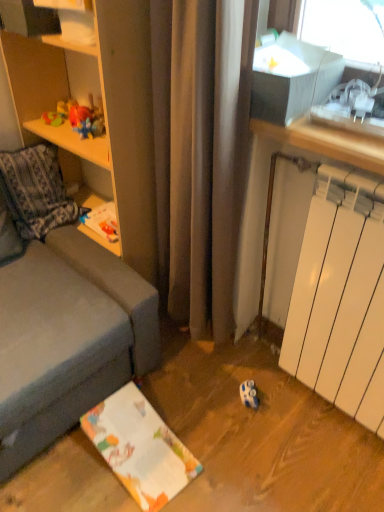
Question: Is the surface of wooden shelf at left in direct contact with white matte radiator at lower right?

Choices:
 (A) yes
 (B) no

Answer: (B)

Question: Considering the relative sizes of wooden shelf at left and white matte radiator at lower right in the image provided, is wooden shelf at left wider than white matte radiator at lower right?

Choices:
 (A) no
 (B) yes

Answer: (B)

Question: Does wooden shelf at left have a lesser width compared to white matte radiator at lower right?

Choices:
 (A) no
 (B) yes

Answer: (A)

Question: From a real-world perspective, does wooden shelf at left stand above white matte radiator at lower right?

Choices:
 (A) no
 (B) yes

Answer: (B)

Question: Does wooden shelf at left appear on the right side of white matte radiator at lower right?

Choices:
 (A) yes
 (B) no

Answer: (B)

Question: Can you confirm if wooden shelf at left is taller than white matte radiator at lower right?

Choices:
 (A) yes
 (B) no

Answer: (A)

Question: Does wooden shelf at left appear on the left side of white glossy shelf at upper left?

Choices:
 (A) no
 (B) yes

Answer: (A)

Question: Would you say white glossy shelf at upper left is part of wooden shelf at left's contents?

Choices:
 (A) yes
 (B) no

Answer: (A)

Question: From a real-world perspective, is wooden shelf at left over white glossy shelf at upper left?

Choices:
 (A) yes
 (B) no

Answer: (B)

Question: From the image's perspective, does wooden shelf at left appear higher than white glossy shelf at upper left?

Choices:
 (A) yes
 (B) no

Answer: (B)

Question: Can you confirm if wooden shelf at left is smaller than white glossy shelf at upper left?

Choices:
 (A) no
 (B) yes

Answer: (A)

Question: From the image's perspective, is wooden shelf at left beneath white glossy shelf at upper left?

Choices:
 (A) yes
 (B) no

Answer: (A)

Question: Is white matte radiator at lower right completely or partially outside of wooden shelf at left?

Choices:
 (A) no
 (B) yes

Answer: (B)